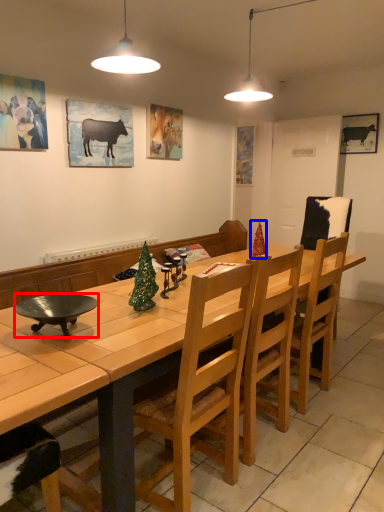
Question: Which of the following is the closest to the observer, bowl (highlighted by a red box) or christmas tree (highlighted by a blue box)?

Choices:
 (A) bowl
 (B) christmas tree

Answer: (A)